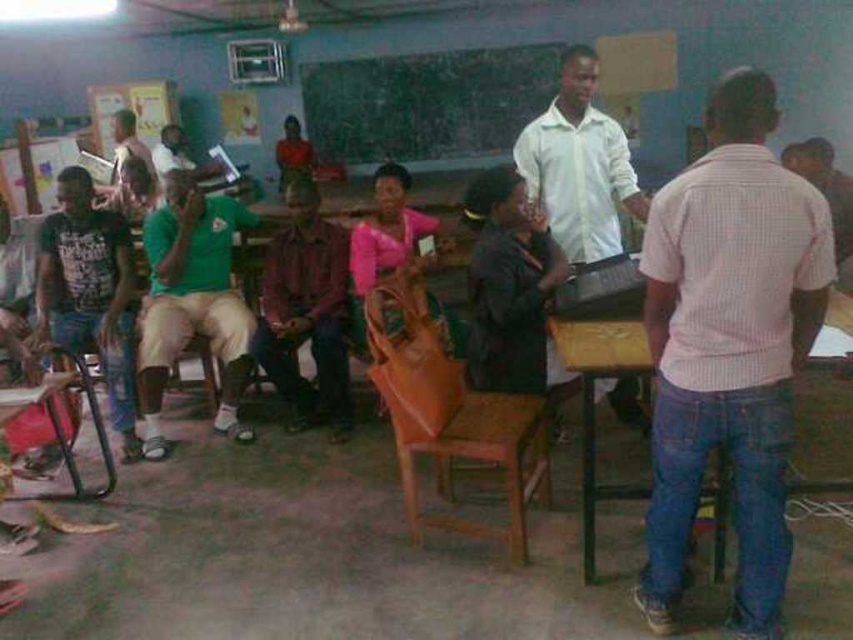
Question: Where is pink checkered shirt at right located in relation to plaid fabric shirt at center in the image?

Choices:
 (A) left
 (B) right

Answer: (B)

Question: Which point appears closest to the camera in this image?

Choices:
 (A) (544, 188)
 (B) (73, 378)
 (C) (294, 308)

Answer: (B)

Question: From the image, what is the correct spatial relationship of pink checkered shirt at right in relation to plaid fabric shirt at center?

Choices:
 (A) right
 (B) left

Answer: (A)

Question: Which point is farther to the camera?

Choices:
 (A) (206, 205)
 (B) (276, 328)

Answer: (A)

Question: Observing the image, what is the correct spatial positioning of brown woven chair at center in reference to green fabric shirt at center?

Choices:
 (A) above
 (B) below

Answer: (B)

Question: Considering the real-world distances, which object is farthest from the plaid fabric shirt at center?

Choices:
 (A) metallic brown chair at lower left
 (B) green chalkboard at upper center

Answer: (B)